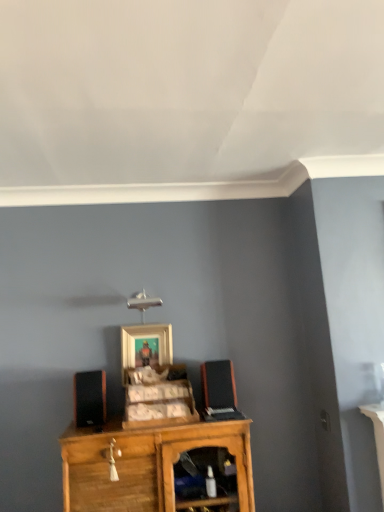
Question: From a real-world perspective, is wooden cabinet at center physically located above or below wooden picture frame at center?

Choices:
 (A) below
 (B) above

Answer: (A)

Question: Is point (127, 430) closer or farther from the camera than point (168, 324)?

Choices:
 (A) farther
 (B) closer

Answer: (B)

Question: Which object is positioned farthest from the wooden picture frame at center?

Choices:
 (A) black matte speaker at right, marked as the 1th speaker in a right-to-left arrangement
 (B) black matte speaker at left, positioned as the 1th speaker in left-to-right order
 (C) wooden cabinet at center
 (D) wooden cabinet at center

Answer: (C)

Question: Estimate the real-world distances between objects in this image. Which object is farther from the black matte speaker at left, positioned as the 1th speaker in left-to-right order?

Choices:
 (A) black matte speaker at right, marked as the 1th speaker in a right-to-left arrangement
 (B) wooden cabinet at center
 (C) wooden picture frame at center
 (D) wooden cabinet at center

Answer: (A)